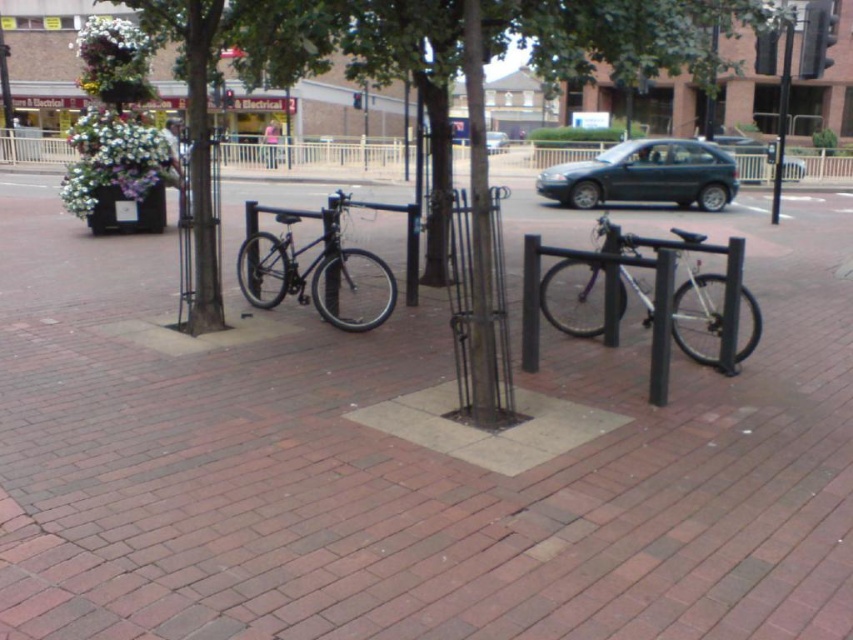
Question: Which point appears farthest from the camera in this image?

Choices:
 (A) (506, 141)
 (B) (252, 284)
 (C) (635, 145)

Answer: (A)

Question: Can you confirm if dark gray metallic hatchback at upper right is thinner than shiny black bicycle at center?

Choices:
 (A) no
 (B) yes

Answer: (A)

Question: Among these points, which one is farthest from the camera?

Choices:
 (A) click(x=792, y=10)
 (B) click(x=805, y=456)
 (C) click(x=474, y=358)
 (D) click(x=755, y=160)

Answer: (D)

Question: Which point is farther to the camera?

Choices:
 (A) light pink fabric at upper center
 (B) black metal pole at upper right
 (C) dark green metallic car at center
 (D) black metal pole at center

Answer: (A)

Question: Does brick pavement at center have a larger size compared to silver metallic bicycle at center right?

Choices:
 (A) no
 (B) yes

Answer: (B)

Question: Is silver metallic bicycle at center right wider than metallic gray sedan at center?

Choices:
 (A) no
 (B) yes

Answer: (A)